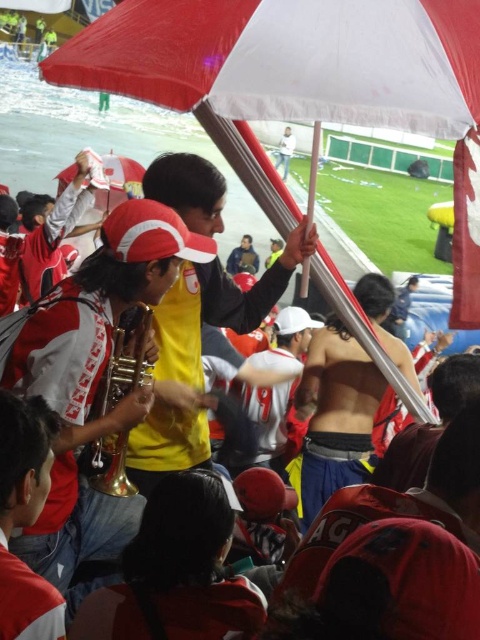
Question: Does red and white fabric umbrella at center have a greater width compared to white matte shirt at upper center?

Choices:
 (A) no
 (B) yes

Answer: (B)

Question: Among these points, which one is farthest from the camera?

Choices:
 (A) (280, 141)
 (B) (144, 22)
 (C) (235, 323)

Answer: (A)

Question: Which of these objects is positioned closest to the yellow matte shirt at center?

Choices:
 (A) red and white fabric umbrella at center
 (B) white matte shirt at upper center

Answer: (A)

Question: Which of the following is the farthest from the observer?

Choices:
 (A) (276, 10)
 (B) (133, 442)
 (C) (283, 164)

Answer: (C)

Question: Is red and white fabric umbrella at center closer to camera compared to yellow matte shirt at center?

Choices:
 (A) yes
 (B) no

Answer: (A)

Question: Does red and white fabric umbrella at center have a lesser width compared to white matte shirt at upper center?

Choices:
 (A) yes
 (B) no

Answer: (B)